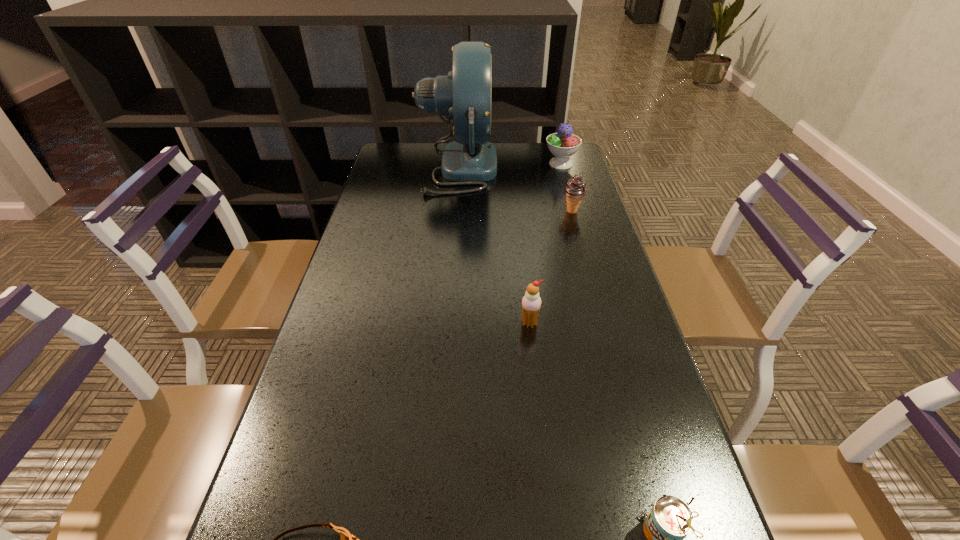
The width and height of the screenshot is (960, 540). In order to click on fan in this screenshot , I will do `click(465, 95)`.

The width and height of the screenshot is (960, 540). I want to click on the farthest icecream, so tap(563, 144).

Identify the location of the third farthest object. Image resolution: width=960 pixels, height=540 pixels. (575, 189).

Locate an element on the screen. the leftmost icecream is located at coordinates (531, 302).

I want to click on the third object from left to right, so click(x=531, y=302).

Identify the location of free space located 0.290m in front of the tallest object to blow air. (577, 167).

Identify the location of free space located 0.370m on the front of the farthest icecream. This screenshot has width=960, height=540. (581, 234).

Locate an element on the screen. The image size is (960, 540). free point located on the back of the third farthest object is located at coordinates (555, 149).

In order to click on vacant point located at the front with a straw on the leftmost icecream in this screenshot , I will do (537, 389).

Identify the location of fan that is at the far edge. The image size is (960, 540). (465, 95).